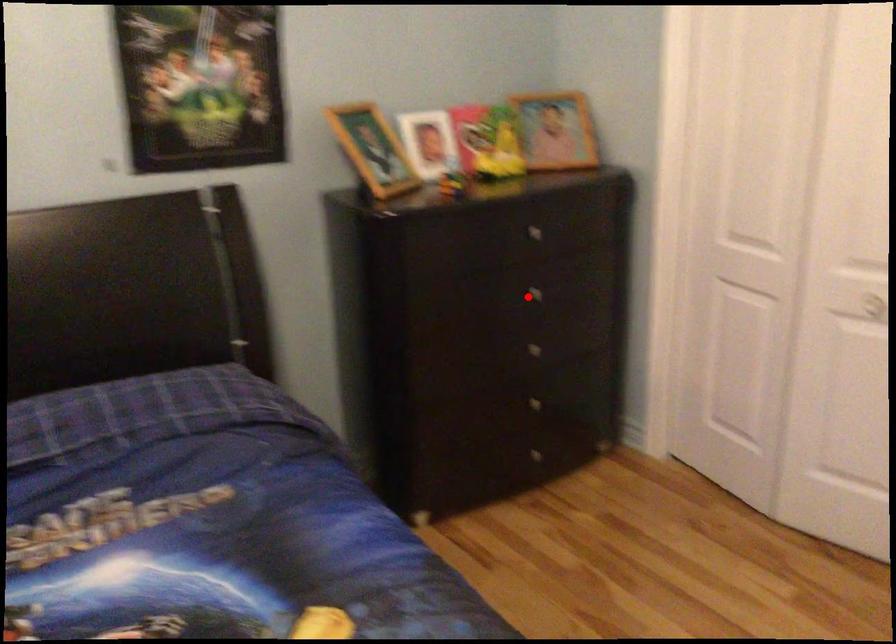
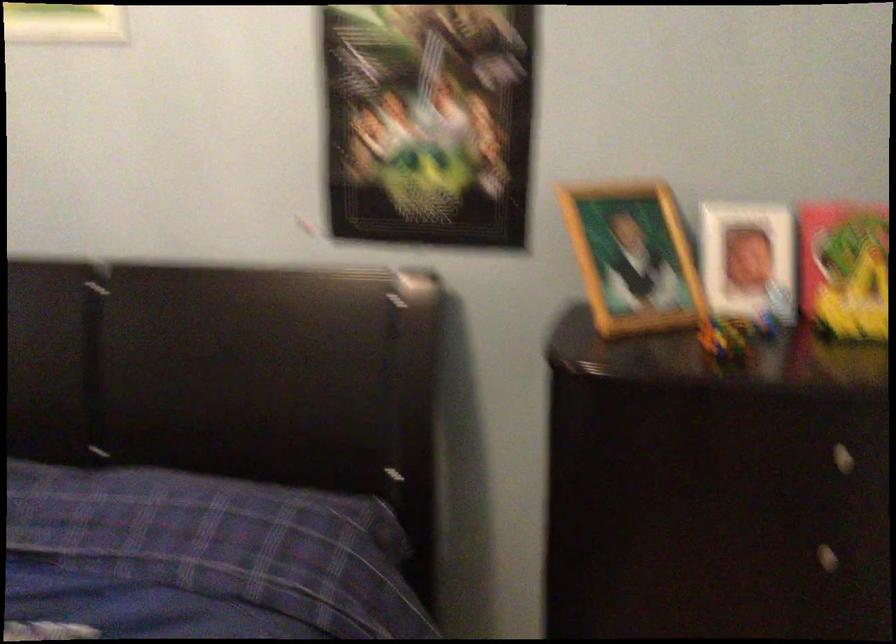
Question: I am providing you with two images of the same scene from different viewpoints. A red point is shown in image1. For the corresponding object point in image2, is it positioned nearer or farther from the camera?

Choices:
 (A) Nearer
 (B) Farther

Answer: (A)